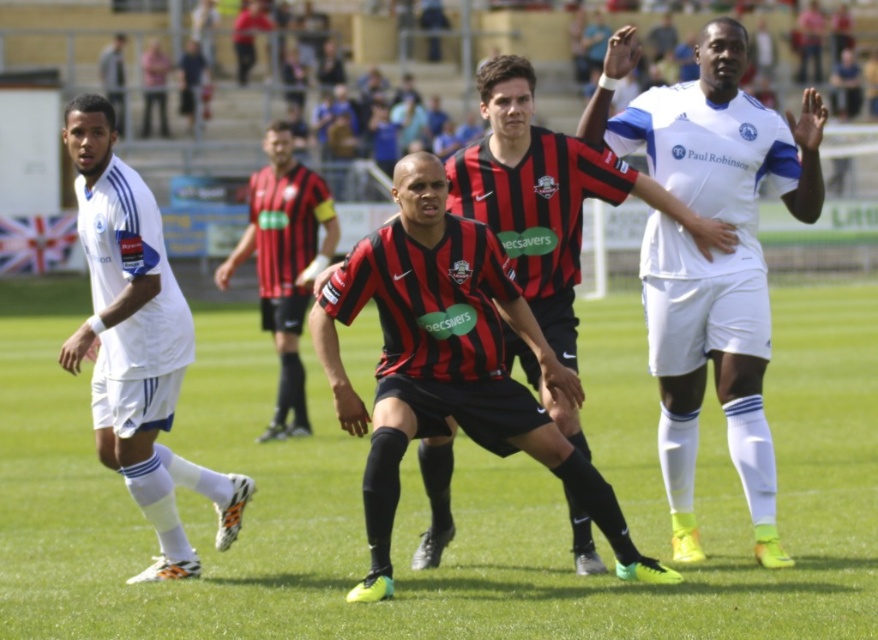
Question: Which of the following is the closest to the observer?

Choices:
 (A) (134, 333)
 (B) (501, 172)
 (C) (426, 625)

Answer: (C)

Question: Is black matte jersey at center positioned in front of red/black striped jersey at center?

Choices:
 (A) no
 (B) yes

Answer: (B)

Question: Which point is farther from the camera taking this photo?

Choices:
 (A) (324, 202)
 (B) (99, 360)
 (C) (506, 83)
 (D) (501, 566)

Answer: (A)

Question: Is green grass football field at center thinner than white matte soccer uniform at left?

Choices:
 (A) yes
 (B) no

Answer: (B)

Question: Which object is the closest to the red/black striped jersey at center?

Choices:
 (A) black matte jersey at center
 (B) green grass football field at center
 (C) white matte soccer uniform at left
 (D) white matte jersey at center

Answer: (B)

Question: Can you confirm if white matte jersey at center is bigger than red/black striped jersey at center?

Choices:
 (A) yes
 (B) no

Answer: (A)